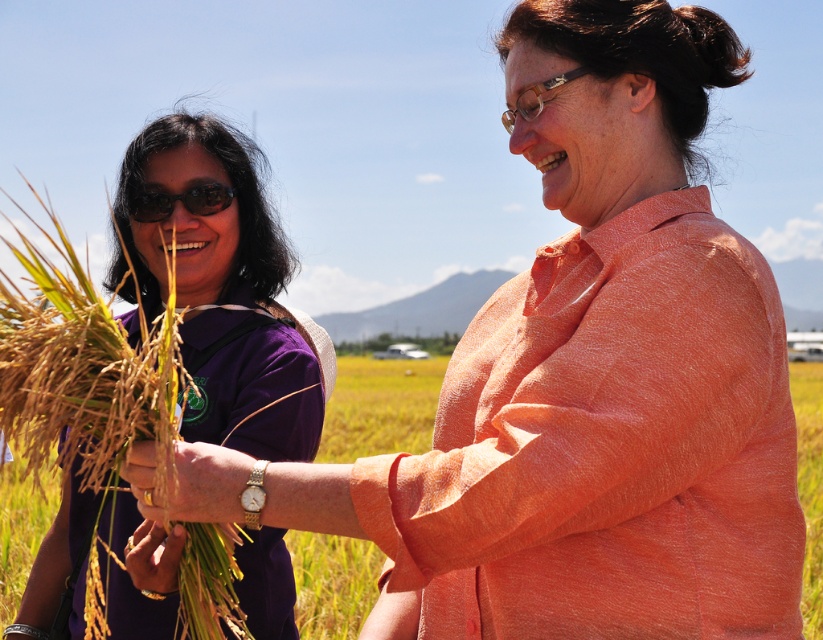
Which of these two, purple fabric shirt at left or matte black sunglasses at left, stands shorter?

matte black sunglasses at left

Find the location of a particular element. purple fabric shirt at left is located at coordinates (219, 288).